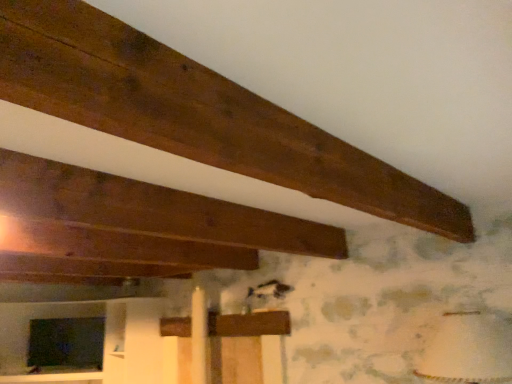
This screenshot has height=384, width=512. What do you see at coordinates (65, 344) in the screenshot?
I see `matte glass window at lower left` at bounding box center [65, 344].

The image size is (512, 384). I want to click on matte glass window at lower left, so click(65, 344).

What is the approximate height of matte glass window at lower left?

20.75 inches.

Find the location of a particular element. The height and width of the screenshot is (384, 512). matte glass window at lower left is located at coordinates (65, 344).